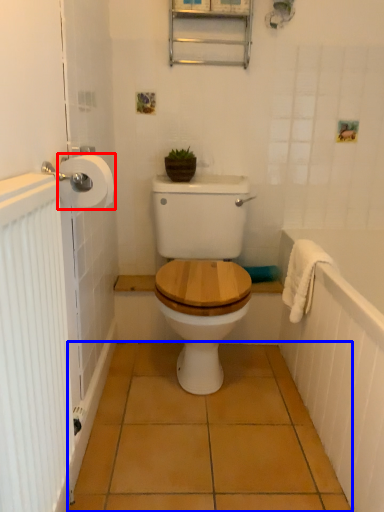
Question: Which of the following is the farthest to the observer, toilet paper (highlighted by a red box) or ceramic tile (highlighted by a blue box)?

Choices:
 (A) toilet paper
 (B) ceramic tile

Answer: (B)